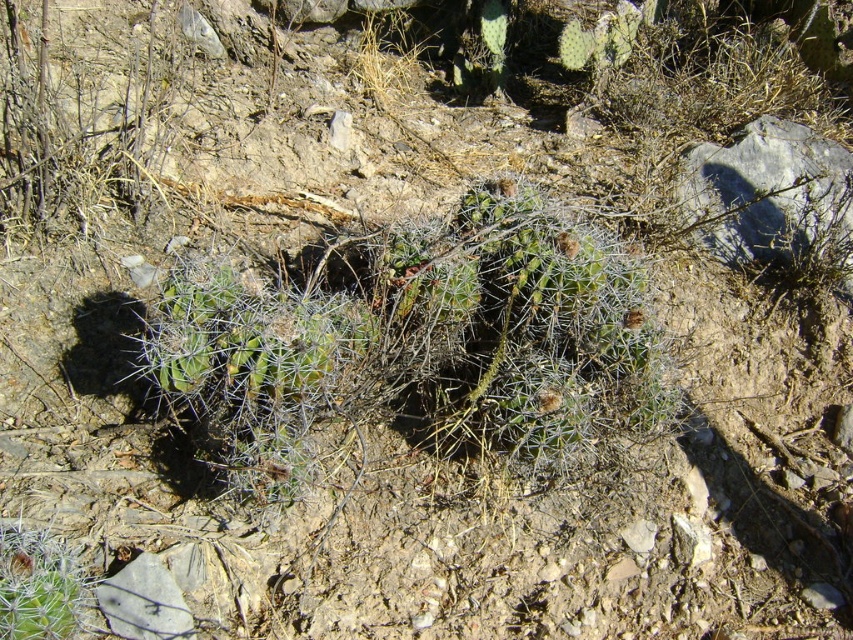
You are a desert explorer trying to locate a hidden oasis. You see two cacti in the center of the desert scene. According to the map, the oasis is located behind the cactus that is closer to the front. Which cactus should you approach first, the spiky green cactus at center or the green spiny cactus at center?

The spiky green cactus at center is positioned over the green spiny cactus at center, meaning it is closer to the front. Therefore, you should approach the spiky green cactus at center first to find the oasis behind it.

You are standing in the desert scene and want to walk from the point at coordinates point (165, 404) to the point at coordinates point (80, 609). Which direction should you face to move towards the second point?

You should face towards the lower right direction because point (80, 609) is closer to the camera than point (165, 404), meaning it is located further away in the lower right direction.

In the scene shown: You are a desert explorer who needs to identify the largest cactus in the scene. According to the image, which one is bigger between the spiky green cactus at center and the green spiny cactus at center?

The spiky green cactus at center is larger in size than the green spiny cactus at center, so the spiky green cactus at center is the bigger one.